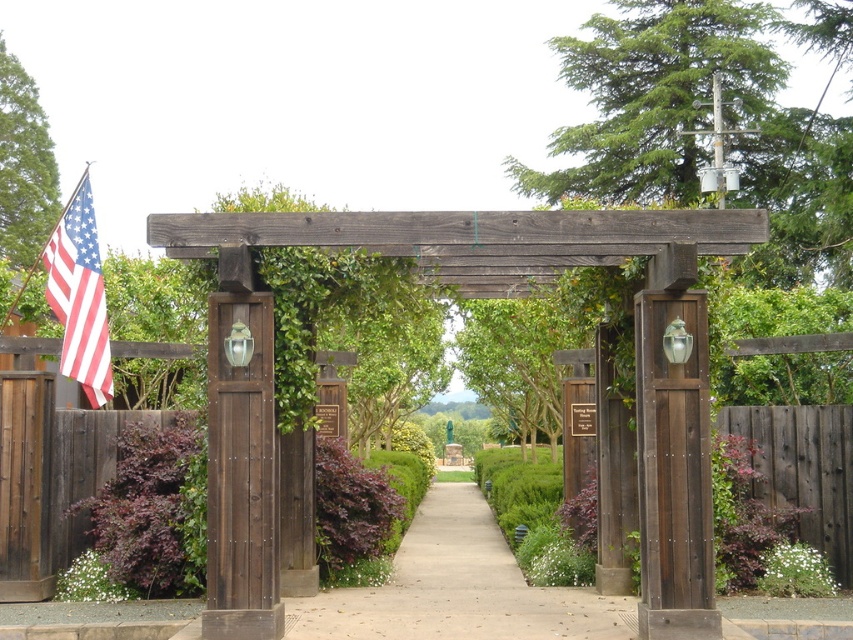
Question: Which point is closer to the camera?

Choices:
 (A) brown wooden post at left
 (B) wooden gate at left
 (C) dark brown wood pergola at center

Answer: (C)

Question: Is dark brown wood pergola at center positioned behind rustic wood post at center?

Choices:
 (A) yes
 (B) no

Answer: (B)

Question: Which object is the farthest from the rustic wood post at center?

Choices:
 (A) metallic flagpole at upper left
 (B) american flag at left
 (C) brown wooden post at left

Answer: (A)

Question: Does rustic wood post at center lie in front of wooden gate at left?

Choices:
 (A) no
 (B) yes

Answer: (B)

Question: Which point is farther from the camera taking this photo?

Choices:
 (A) (9, 488)
 (B) (693, 449)
 (C) (73, 232)

Answer: (C)

Question: Is rustic wood post at center thinner than brown wooden post at left?

Choices:
 (A) yes
 (B) no

Answer: (A)